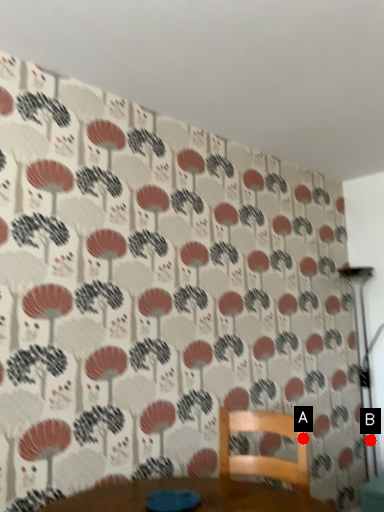
Question: Two points are circled on the image, labeled by A and B beside each circle. Which point is further to the camera?

Choices:
 (A) A is further
 (B) B is further

Answer: (B)